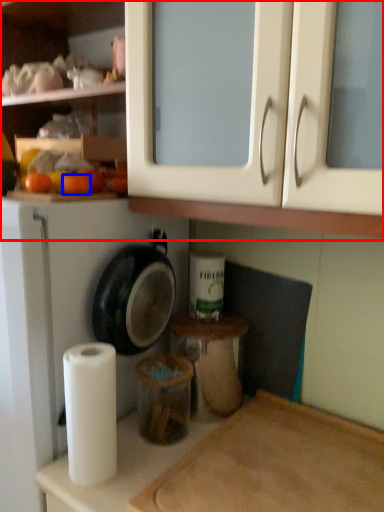
Question: Which of the following is the closest to the observer, cabinetry (highlighted by a red box) or orange (highlighted by a blue box)?

Choices:
 (A) cabinetry
 (B) orange

Answer: (A)